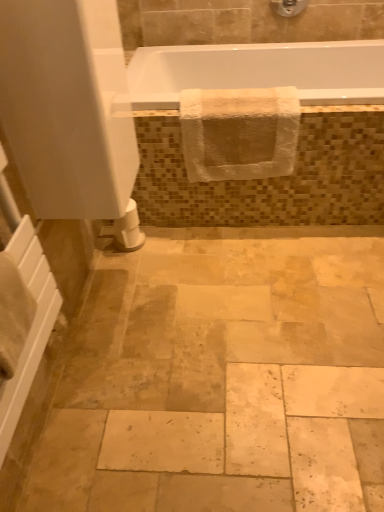
The image size is (384, 512). What are the coordinates of `vacant region below white matte screen door at upper left (from a real-world perspective)` in the screenshot? It's located at (124, 279).